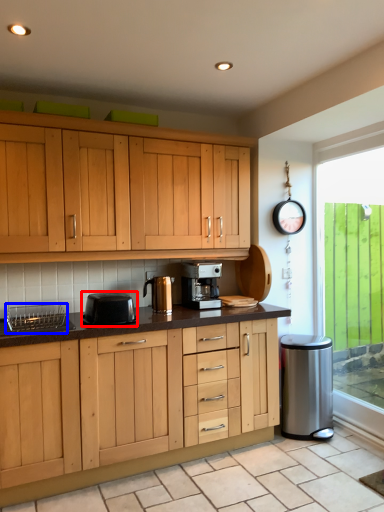
Question: Which point is closer to the camera, kitchen appliance (highlighted by a red box) or appliance (highlighted by a blue box)?

Choices:
 (A) kitchen appliance
 (B) appliance

Answer: (B)